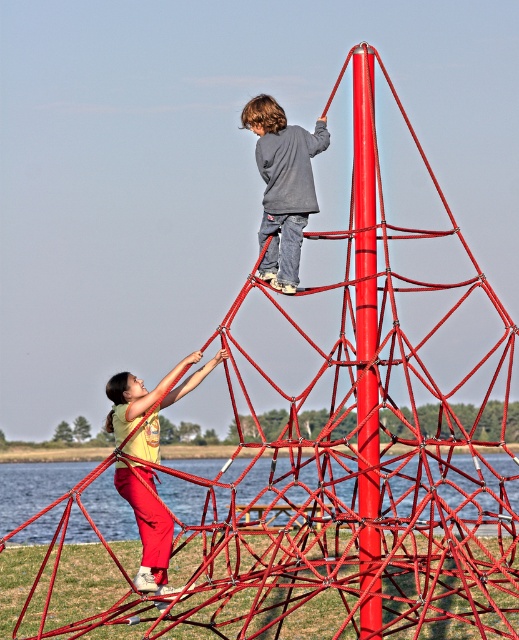
Between glossy metal pole at upper center and matte yellow shirt at center, which one appears on the left side from the viewer's perspective?

matte yellow shirt at center is more to the left.

The width and height of the screenshot is (519, 640). What are the coordinates of `glossy metal pole at upper center` in the screenshot? It's located at (365, 342).

Is point (365, 112) more distant than point (124, 496)?

No, it is not.

The image size is (519, 640). In order to click on glossy metal pole at upper center in this screenshot , I will do `click(365, 342)`.

Does gray cotton shirt at upper center appear over matte yellow shirt at center?

Yes, gray cotton shirt at upper center is above matte yellow shirt at center.

Can you confirm if gray cotton shirt at upper center is positioned below matte yellow shirt at center?

No.

Which is behind, point (311, 141) or point (107, 387)?

The point (311, 141) is behind.

Identify the location of gray cotton shirt at upper center. (282, 186).

Which is more to the left, glossy metal pole at upper center or gray cotton shirt at upper center?

gray cotton shirt at upper center is more to the left.

Is glossy metal pole at upper center shorter than gray cotton shirt at upper center?

Correct, glossy metal pole at upper center is not as tall as gray cotton shirt at upper center.

The image size is (519, 640). I want to click on glossy metal pole at upper center, so click(x=365, y=342).